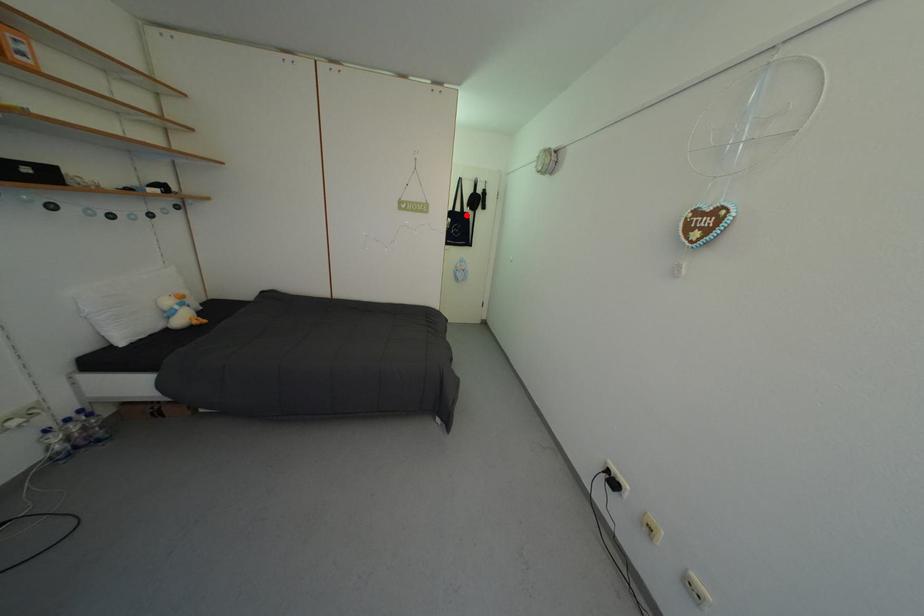
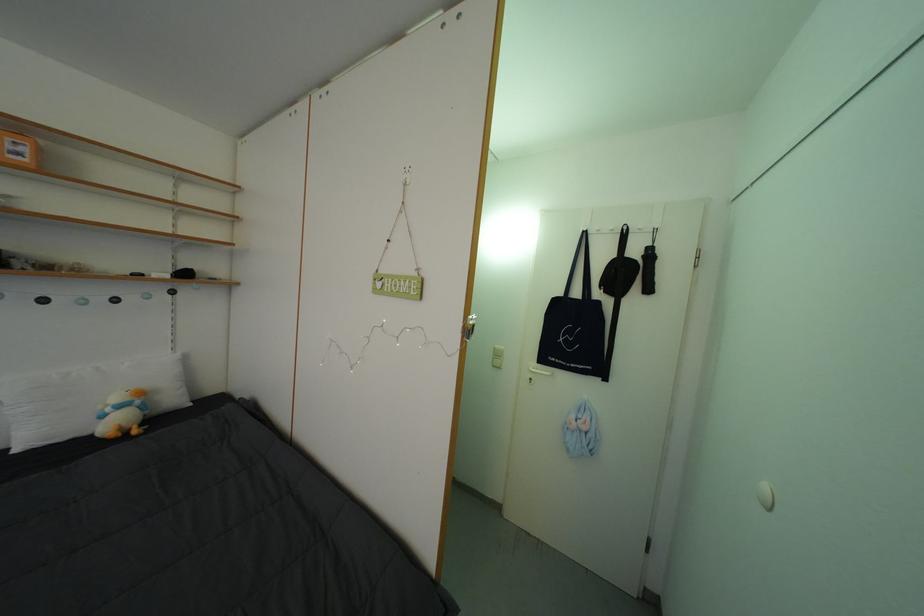
Question: I am providing you with two images of the same scene from different viewpoints. Image1 has a red point marked. In image2, the corresponding 3D location appears at what relative position? Reply with the corresponding letter.

Choices:
 (A) Closer
 (B) Farther

Answer: (B)